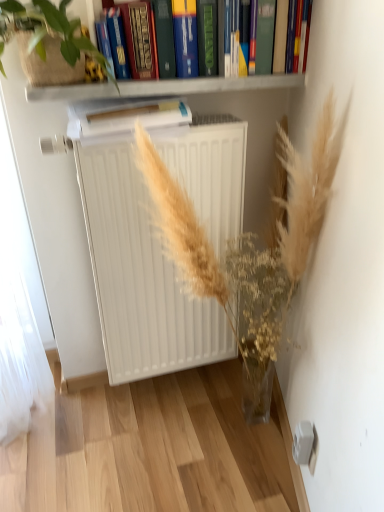
Question: Can you confirm if green leafy plant at upper left is taller than white matte radiator at center?

Choices:
 (A) yes
 (B) no

Answer: (B)

Question: Is green leafy plant at upper left closer to camera compared to white matte radiator at center?

Choices:
 (A) no
 (B) yes

Answer: (B)

Question: Considering the relative sizes of green leafy plant at upper left and white matte radiator at center in the image provided, is green leafy plant at upper left bigger than white matte radiator at center?

Choices:
 (A) no
 (B) yes

Answer: (A)

Question: Would you say green leafy plant at upper left contains white matte radiator at center?

Choices:
 (A) no
 (B) yes

Answer: (A)

Question: Is green leafy plant at upper left looking in the opposite direction of white matte radiator at center?

Choices:
 (A) yes
 (B) no

Answer: (B)

Question: From a real-world perspective, is white paper at center, which appears as the 2th paperback book when viewed from the top, physically located above or below white matte radiator at center?

Choices:
 (A) below
 (B) above

Answer: (B)

Question: Would you say white paper at center, which appears as the first paperback book when ordered from the bottom, is to the left or to the right of white matte radiator at center in the picture?

Choices:
 (A) left
 (B) right

Answer: (A)

Question: Looking at their shapes, would you say white paper at center, which appears as the first paperback book when ordered from the bottom, is wider or thinner than white matte radiator at center?

Choices:
 (A) thin
 (B) wide

Answer: (B)

Question: Which is correct: white paper at center, which appears as the 2th paperback book when viewed from the top, is inside white matte radiator at center, or outside of it?

Choices:
 (A) inside
 (B) outside

Answer: (B)

Question: Is white matte shelf at upper center taller or shorter than green leafy plant at upper left?

Choices:
 (A) tall
 (B) short

Answer: (B)

Question: Would you say white matte shelf at upper center is to the left or to the right of green leafy plant at upper left in the picture?

Choices:
 (A) left
 (B) right

Answer: (B)

Question: Is point (226, 89) closer or farther from the camera than point (67, 57)?

Choices:
 (A) closer
 (B) farther

Answer: (B)

Question: Looking at the image, does white matte shelf at upper center seem bigger or smaller compared to green leafy plant at upper left?

Choices:
 (A) small
 (B) big

Answer: (A)

Question: Would you say white matte shelf at upper center is inside or outside hardcover book at upper center?

Choices:
 (A) inside
 (B) outside

Answer: (B)

Question: From the image's perspective, relative to hardcover book at upper center, is white matte shelf at upper center above or below?

Choices:
 (A) above
 (B) below

Answer: (B)